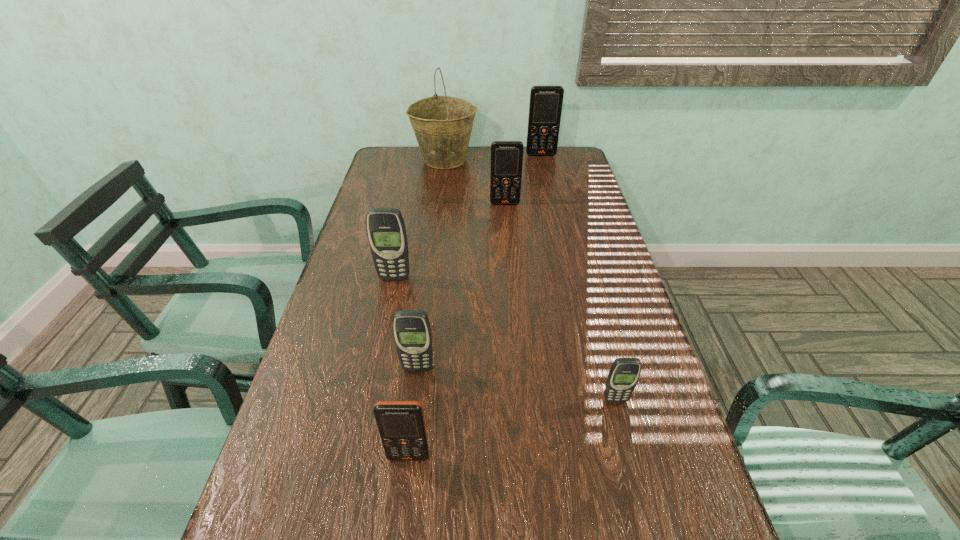
I want to click on the nearest orange cellular telephone, so click(x=401, y=424).

This screenshot has height=540, width=960. Identify the location of the smallest gray cellular telephone. (624, 373).

Identify the location of the second nearest cellular telephone. (624, 373).

Find the location of a particular element. The height and width of the screenshot is (540, 960). vacant area located on the right of the tallest object is located at coordinates (562, 160).

The height and width of the screenshot is (540, 960). In order to click on blank area located on the screen of the farthest orange cellular telephone in this screenshot , I will do `click(547, 183)`.

This screenshot has width=960, height=540. What are the coordinates of `vacant space situated 0.100m on the screen of the second farthest cellular telephone` in the screenshot? It's located at 506,223.

You are a GUI agent. You are given a task and a screenshot of the screen. Output one action in this format:
    pyautogui.click(x=<x>, y=<y>)
    Task: Click on the vacant space positioned on the screen of the fourth farthest object
    
    Given the screenshot: What is the action you would take?
    pyautogui.click(x=375, y=368)

Find the location of a particular element. The image size is (960, 540). vacant space positioned on the screen of the third nearest object is located at coordinates (411, 420).

Image resolution: width=960 pixels, height=540 pixels. In order to click on vacant space situated 0.080m on the screen of the nearest object in this screenshot , I will do `click(402, 507)`.

The height and width of the screenshot is (540, 960). I want to click on free space located on the screen of the second nearest object, so click(621, 424).